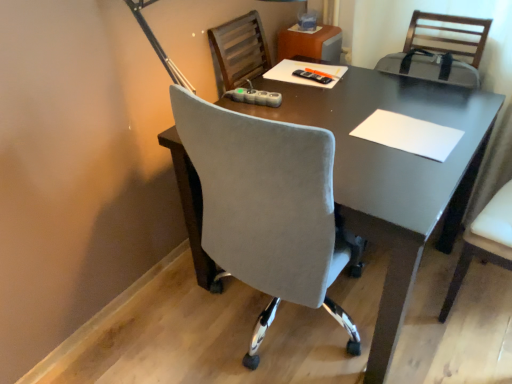
You are a GUI agent. You are given a task and a screenshot of the screen. Output one action in this format:
    pyautogui.click(x=<x>, y=<y>)
    Task: Click on the blank space to the left of white paper at center
    This screenshot has width=512, height=384.
    Given the screenshot: What is the action you would take?
    pyautogui.click(x=341, y=133)